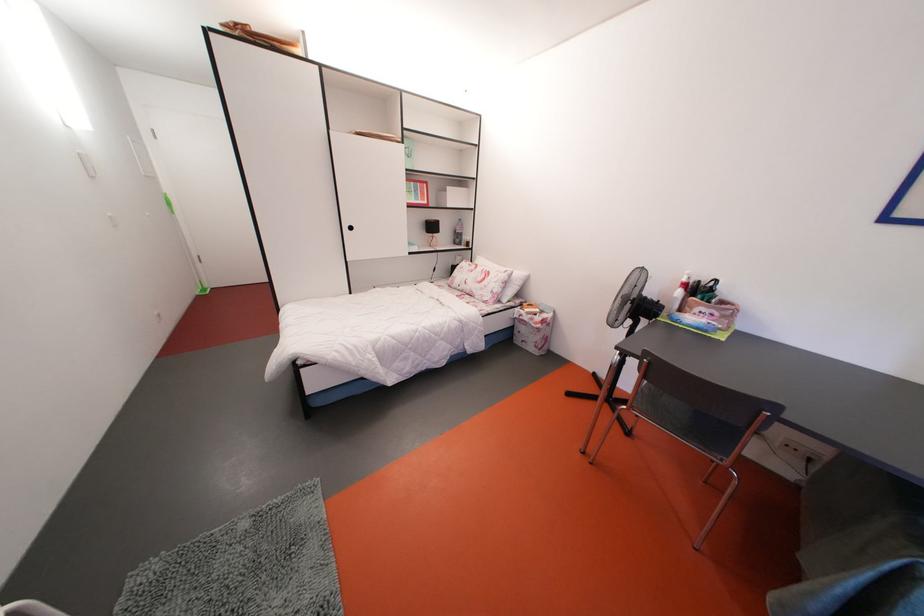
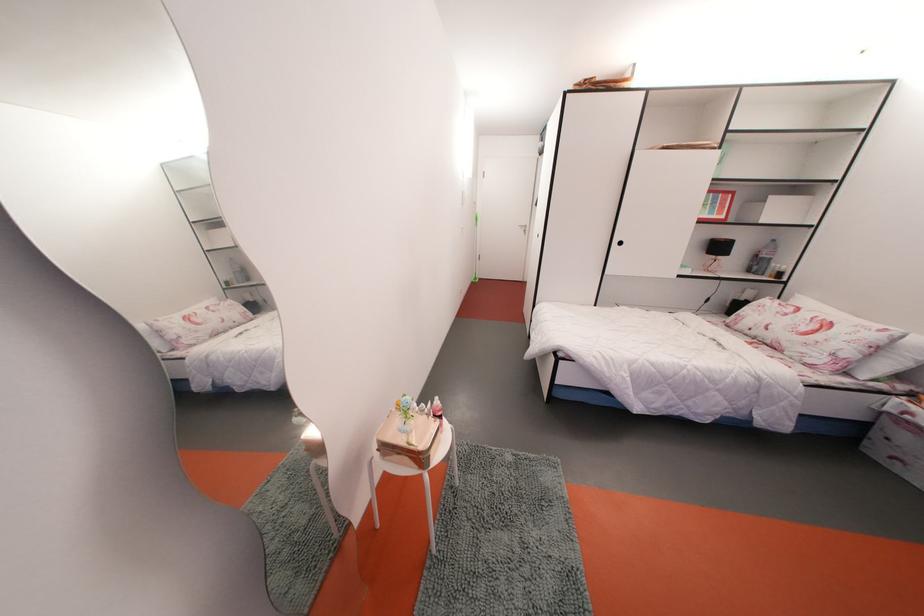
In the second image, find the point that corresponds to the point at 465,241 in the first image.

(764, 268)